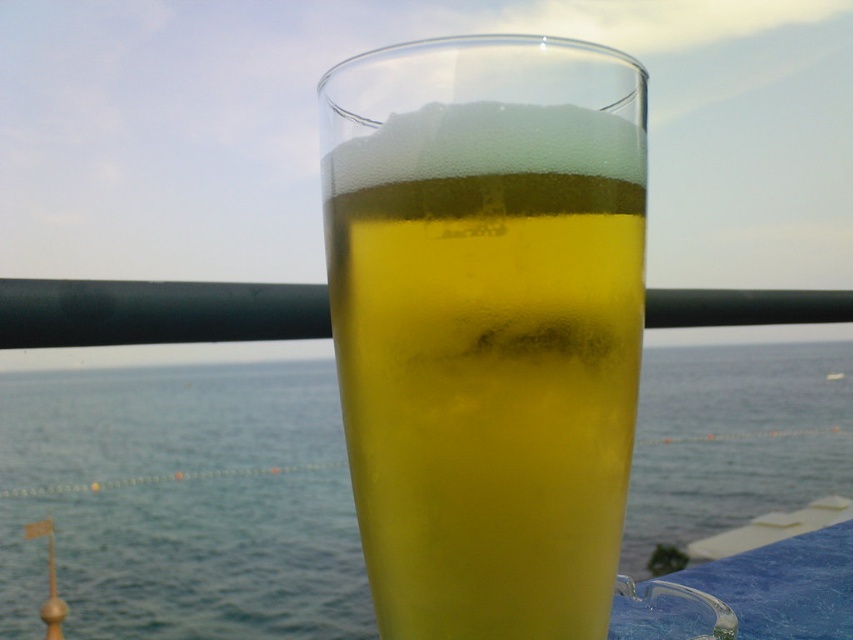
You are standing in a room with a view of the ocean. There is a translucent glass at center on a table. If you want to reach the glass without moving your feet, which direction should you extend your hand?

Since the translucent glass at center is positioned at point coordinates, you should extend your hand directly in front of you to reach it, as it is centered in your field of view.

You are standing in a room with a glass of beer and a view of the ocean. You notice two points marked on the wall. The first point is at coordinates point [489,424] and the second is at point [22,627]. Which point is closer to you?

Point [489,424] is in front of point [22,627], so it is closer to you.

You are standing in a room with a glass of beer and a black railing in the background. There is a point at coordinates (486, 324). What object is located at that point?

The point at coordinates (486, 324) is occupied by a translucent glass at center.